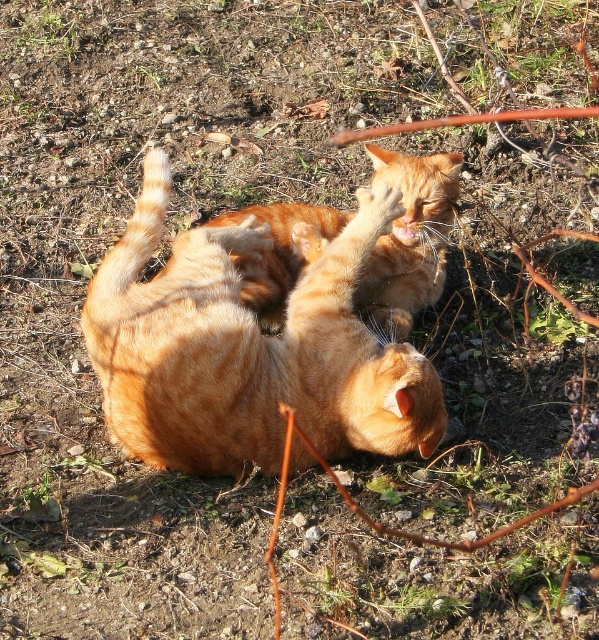
You are a photographer trying to capture a photo of both cats. To ensure both are visible in the frame, which cat should you focus on first, the orange fur cat at center or the orange tabby cat at center?

You should focus on the orange tabby cat at center first because it is positioned above the orange fur cat at center, making it more visible in the frame.

You are a photographer trying to capture a closeup of the orange fur cat at center. Given that your camera has a focal length of 50mm and you are currently positioned 2 meters away from the point at coordinates (249,348), can you estimate whether you need to move closer or farther away to focus on the orange fur cat at center?

The point at coordinates (249,348) indicates the orange fur cat at center. Since you are currently 2 meters away, you need to move closer to focus on the orange fur cat at center with a 50mm lens.